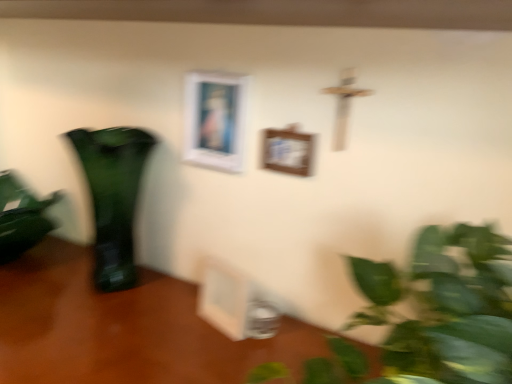
Find the location of a particular element. The width and height of the screenshot is (512, 384). wooden picture frame at center, which ranks as the 2th picture frame in bottom-to-top order is located at coordinates (288, 151).

Describe the element at coordinates (288, 151) in the screenshot. I see `wooden picture frame at center, marked as the second picture frame in a top-to-bottom arrangement` at that location.

What is the approximate width of green glass vase at left?

green glass vase at left is 5.81 inches in width.

Looking at this image, in order to face green glossy houseplant at left, should I rotate leftwards or rightwards?

Rotate left and turn 30.478 degrees.

Identify the location of wooden picture frame at center, marked as the second picture frame in a top-to-bottom arrangement. (288, 151).

From a real-world perspective, which is physically above, white matte picture frame at upper center, which ranks as the 3th picture frame in bottom-to-top order, or green glossy houseplant at left?

In real-world perspective, white matte picture frame at upper center, which ranks as the 3th picture frame in bottom-to-top order, is above.

Which of these two, white matte picture frame at upper center, which is the 1th picture frame from top to bottom, or green glossy houseplant at left, is smaller?

white matte picture frame at upper center, which is the 1th picture frame from top to bottom, is smaller.

Measure the distance between white matte picture frame at upper center, which is the 1th picture frame from top to bottom, and green glossy houseplant at left.

white matte picture frame at upper center, which is the 1th picture frame from top to bottom, and green glossy houseplant at left are 51.45 centimeters apart from each other.

Is white matte picture frame at upper center, which ranks as the 3th picture frame in bottom-to-top order, completely or partially outside of green glossy houseplant at left?

white matte picture frame at upper center, which ranks as the 3th picture frame in bottom-to-top order, lies outside green glossy houseplant at left's area.

Which object is further away from the camera, white matte picture frame at upper center, which ranks as the 3th picture frame in bottom-to-top order, or green glass vase at left?

white matte picture frame at upper center, which ranks as the 3th picture frame in bottom-to-top order, is more distant.

Considering the relative positions of white matte picture frame at upper center, which ranks as the 3th picture frame in bottom-to-top order, and green glass vase at left in the image provided, is white matte picture frame at upper center, which ranks as the 3th picture frame in bottom-to-top order, to the right of green glass vase at left from the viewer's perspective?

Yes.

Consider the image. Is white matte picture frame at upper center, which ranks as the 3th picture frame in bottom-to-top order, positioned with its back to green glass vase at left?

No, white matte picture frame at upper center, which ranks as the 3th picture frame in bottom-to-top order, is not facing away from green glass vase at left.

Considering the sizes of objects white matte picture frame at upper center, which ranks as the 3th picture frame in bottom-to-top order, and green glass vase at left in the image provided, who is thinner, white matte picture frame at upper center, which ranks as the 3th picture frame in bottom-to-top order, or green glass vase at left?

Thinner between the two is white matte picture frame at upper center, which ranks as the 3th picture frame in bottom-to-top order.

From the image's perspective, does wooden table at lower left appear lower than green glass vase at left?

Yes, from the image's perspective, wooden table at lower left is below green glass vase at left.

From a real-world perspective, which object stands above the other?

In real-world perspective, green glass vase at left is above.

Based on the photo, how distant is wooden table at lower left from green glass vase at left?

7.34 inches.

Can you confirm if wooden table at lower left is smaller than green glass vase at left?

No, wooden table at lower left is not smaller than green glass vase at left.

Between white matte picture frame at upper center, which ranks as the 3th picture frame in bottom-to-top order, and wooden table at lower left, which one has larger width?

wooden table at lower left is wider.

Is white matte picture frame at upper center, which is the 1th picture frame from top to bottom, looking in the opposite direction of wooden table at lower left?

white matte picture frame at upper center, which is the 1th picture frame from top to bottom, is not turned away from wooden table at lower left.

From the picture: Is the surface of white matte picture frame at upper center, which is the 1th picture frame from top to bottom, in direct contact with wooden table at lower left?

No, white matte picture frame at upper center, which is the 1th picture frame from top to bottom, is not touching wooden table at lower left.

Is green glass vase at left not within white matte picture frame at upper center, which ranks as the 3th picture frame in bottom-to-top order?

Absolutely, green glass vase at left is external to white matte picture frame at upper center, which ranks as the 3th picture frame in bottom-to-top order.

Which object is thinner, green glass vase at left or white matte picture frame at upper center, which is the 1th picture frame from top to bottom?

white matte picture frame at upper center, which is the 1th picture frame from top to bottom, is thinner.

From the image's perspective, is green glass vase at left under white matte picture frame at upper center, which ranks as the 3th picture frame in bottom-to-top order?

Yes, from the image's perspective, green glass vase at left is beneath white matte picture frame at upper center, which ranks as the 3th picture frame in bottom-to-top order.

How many degrees apart are the facing directions of green glass vase at left and white matte picture frame at upper center, which ranks as the 3th picture frame in bottom-to-top order?

0.654 degrees separate the facing orientations of green glass vase at left and white matte picture frame at upper center, which ranks as the 3th picture frame in bottom-to-top order.

Is wooden table at lower left far from white matte picture frame at upper center, which ranks as the 3th picture frame in bottom-to-top order?

No, wooden table at lower left is not far away from white matte picture frame at upper center, which ranks as the 3th picture frame in bottom-to-top order.

Visually, is wooden table at lower left positioned to the left or to the right of white matte picture frame at upper center, which ranks as the 3th picture frame in bottom-to-top order?

Based on their positions, wooden table at lower left is located to the left of white matte picture frame at upper center, which ranks as the 3th picture frame in bottom-to-top order.

Between point (200, 358) and point (224, 168), which one is positioned in front?

The point (200, 358) is more forward.

Looking at their sizes, would you say wooden table at lower left is wider or thinner than white matte picture frame at upper center, which ranks as the 3th picture frame in bottom-to-top order?

Result: In the image, wooden table at lower left appears to be wider than white matte picture frame at upper center, which ranks as the 3th picture frame in bottom-to-top order.

Is wooden picture frame at center, the third picture frame when ordered from top to bottom, thinner than white matte picture frame at upper center, which is the 1th picture frame from top to bottom?

No, wooden picture frame at center, the third picture frame when ordered from top to bottom, is not thinner than white matte picture frame at upper center, which is the 1th picture frame from top to bottom.

From their relative heights in the image, would you say wooden picture frame at center, acting as the first picture frame starting from the bottom, is taller or shorter than white matte picture frame at upper center, which ranks as the 3th picture frame in bottom-to-top order?

In the image, wooden picture frame at center, acting as the first picture frame starting from the bottom, appears to be shorter than white matte picture frame at upper center, which ranks as the 3th picture frame in bottom-to-top order.

This screenshot has height=384, width=512. In order to click on houseplant behind the white matte picture frame at upper center, which ranks as the 3th picture frame in bottom-to-top order in this screenshot , I will do `click(21, 217)`.

Locate an element on the screen. The height and width of the screenshot is (384, 512). vase to the left of white matte picture frame at upper center, which ranks as the 3th picture frame in bottom-to-top order is located at coordinates (113, 197).

Looking at the image, which one is located closer to wooden table at lower left, green glass vase at left or green glossy houseplant at left?

green glass vase at left lies closer to wooden table at lower left than the other object.

Which object lies nearer to the anchor point white matte picture frame at upper center, which is the 1th picture frame from top to bottom, green glass vase at left or green glossy houseplant at left?

Among the two, green glass vase at left is located nearer to white matte picture frame at upper center, which is the 1th picture frame from top to bottom.

Based on their spatial positions, is wooden picture frame at center, which ranks as the 2th picture frame in bottom-to-top order, or wooden picture frame at center, the third picture frame when ordered from top to bottom, further from white matte picture frame at upper center, which ranks as the 3th picture frame in bottom-to-top order?

wooden picture frame at center, the third picture frame when ordered from top to bottom, is positioned further to the anchor white matte picture frame at upper center, which ranks as the 3th picture frame in bottom-to-top order.

Considering their positions, is wooden table at lower left positioned closer to wooden picture frame at center, marked as the second picture frame in a top-to-bottom arrangement, than green glossy houseplant at left?

The object closer to wooden picture frame at center, marked as the second picture frame in a top-to-bottom arrangement, is wooden table at lower left.

Looking at the image, which one is located further to green glass vase at left, white matte picture frame at upper center, which is the 1th picture frame from top to bottom, or wooden picture frame at center, marked as the second picture frame in a top-to-bottom arrangement?

The object further to green glass vase at left is wooden picture frame at center, marked as the second picture frame in a top-to-bottom arrangement.

Estimate the real-world distances between objects in this image. Which object is further from white matte picture frame at upper center, which is the 1th picture frame from top to bottom, wooden picture frame at center, acting as the first picture frame starting from the bottom, or green glass vase at left?

wooden picture frame at center, acting as the first picture frame starting from the bottom, is positioned further to the anchor white matte picture frame at upper center, which is the 1th picture frame from top to bottom.

Looking at the image, which one is located closer to white matte picture frame at upper center, which is the 1th picture frame from top to bottom, green glossy houseplant at left or wooden picture frame at center, acting as the first picture frame starting from the bottom?

Based on the image, wooden picture frame at center, acting as the first picture frame starting from the bottom, appears to be nearer to white matte picture frame at upper center, which is the 1th picture frame from top to bottom.

Estimate the real-world distances between objects in this image. Which object is further from wooden table at lower left, wooden picture frame at center, marked as the second picture frame in a top-to-bottom arrangement, or green glossy houseplant at left?

wooden picture frame at center, marked as the second picture frame in a top-to-bottom arrangement, lies further to wooden table at lower left than the other object.

You are a GUI agent. You are given a task and a screenshot of the screen. Output one action in this format:
    pyautogui.click(x=<x>, y=<y>)
    Task: Click on the table between green glossy houseplant at left and wooden picture frame at center, acting as the first picture frame starting from the bottom, from left to right
    Image resolution: width=512 pixels, height=384 pixels.
    Given the screenshot: What is the action you would take?
    pyautogui.click(x=123, y=328)

This screenshot has height=384, width=512. In order to click on houseplant that lies between green glass vase at left and wooden table at lower left from top to bottom in this screenshot , I will do `click(21, 217)`.

Locate an element on the screen. Image resolution: width=512 pixels, height=384 pixels. vase between white matte picture frame at upper center, which is the 1th picture frame from top to bottom, and wooden table at lower left from top to bottom is located at coordinates (113, 197).

Locate an element on the screen. The width and height of the screenshot is (512, 384). picture frame between wooden picture frame at center, marked as the second picture frame in a top-to-bottom arrangement, and wooden table at lower left vertically is located at coordinates (223, 297).